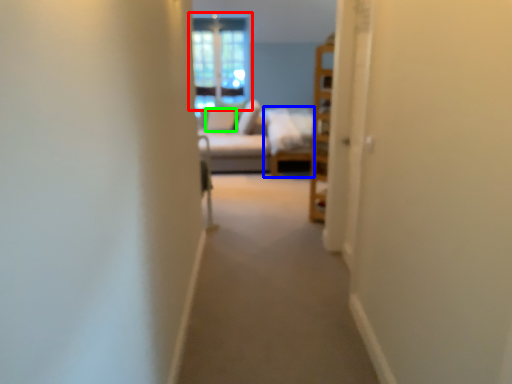
Question: Which object is the closest to the window (highlighted by a red box)? Choose among these: couch (highlighted by a blue box) or pillow (highlighted by a green box).

Choices:
 (A) couch
 (B) pillow

Answer: (B)